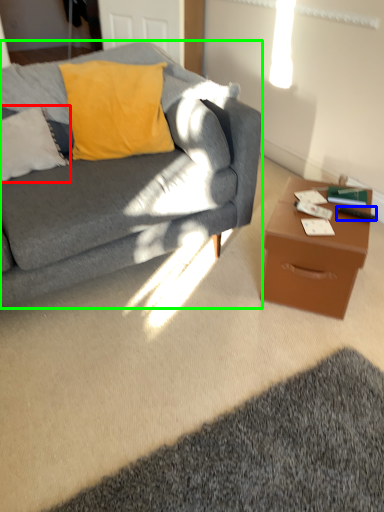
Question: Estimate the real-world distances between objects in this image. Which object is farther from pillow (highlighted by a red box), remote control (highlighted by a blue box) or studio couch (highlighted by a green box)?

Choices:
 (A) remote control
 (B) studio couch

Answer: (A)